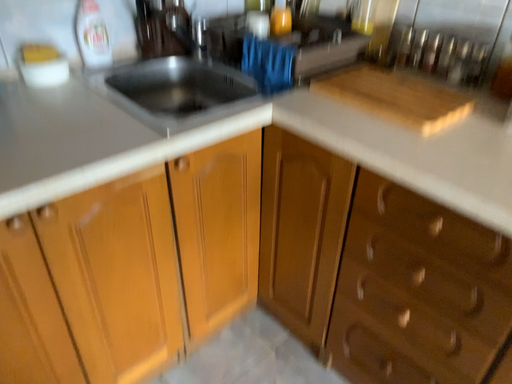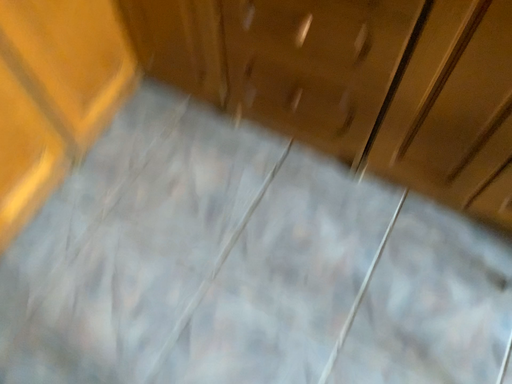
Question: Which way did the camera rotate in the video?

Choices:
 (A) rotated upward
 (B) rotated downward

Answer: (B)